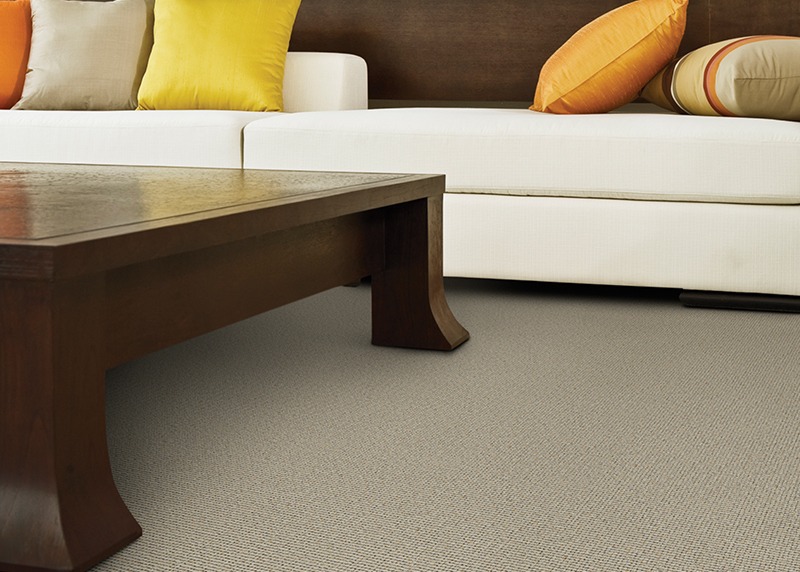
At what (x,y) coordinates should I click in order to perform the action: click on carpet. Please return your answer as a coordinate pair (x, y). This screenshot has width=800, height=572. Looking at the image, I should click on (358, 460).